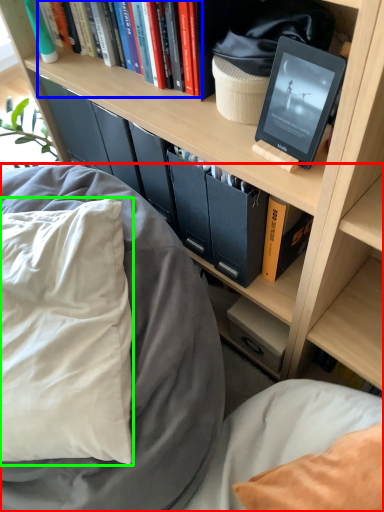
Question: Which object is the farthest from bed (highlighted by a red box)? Choose among these: book (highlighted by a blue box) or pillow (highlighted by a green box).

Choices:
 (A) book
 (B) pillow

Answer: (A)